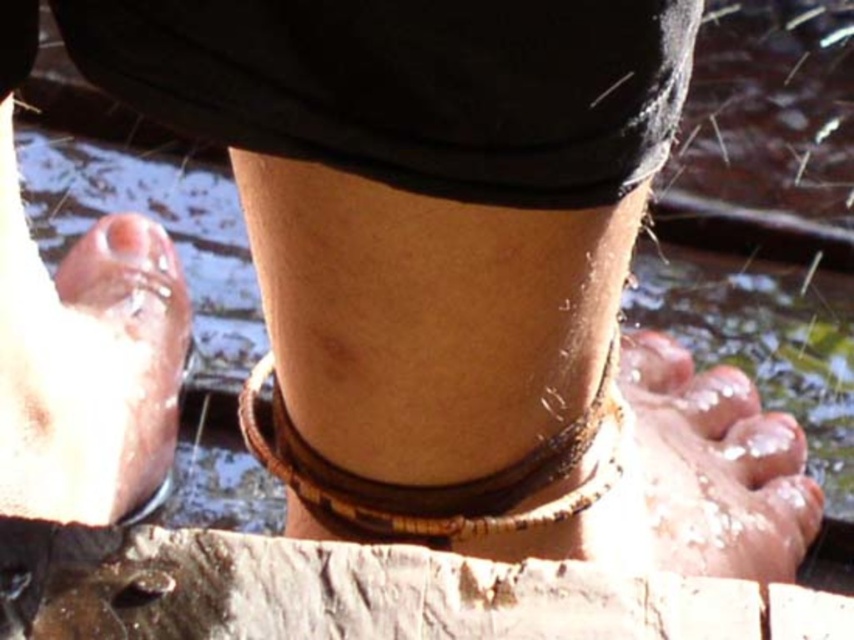
You are a photographer trying to capture the reflection of the two points in the water. Which point, point (9, 483) or point (723, 435), will appear closer to the camera in the reflection?

Point (9, 483) is closer to the camera than point (723, 435), so its reflection will also appear closer to the camera.

You are a lifeguard observing the scene. You notice the brown rough wood at lower center and the pink smooth skin at lower left. Which object is wider?

The brown rough wood at lower center is wider than the pink smooth skin at lower left.

Where is the brown leather anklet at center located in the image?

The brown leather anklet at center is located at point (575, 486) in the image.